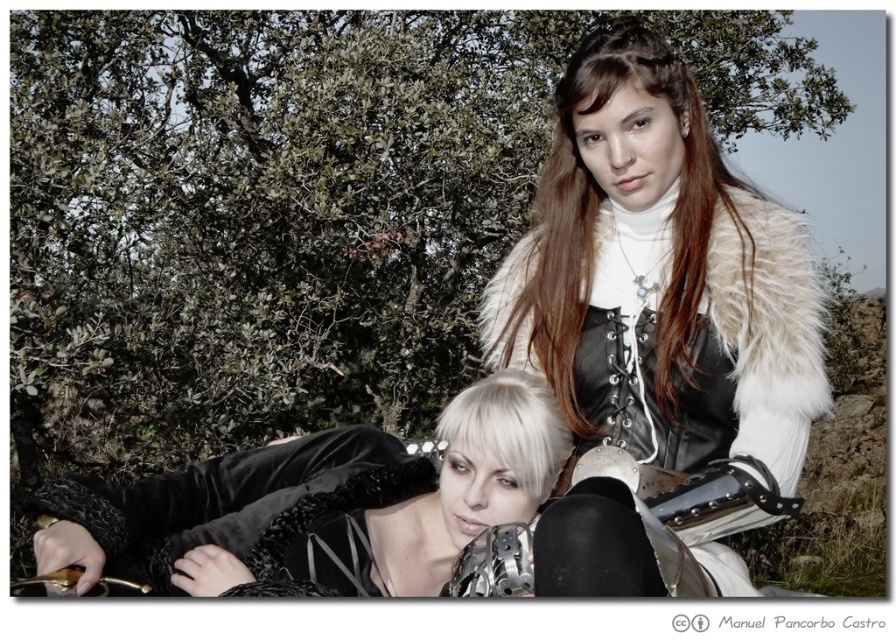
Who is taller, fur-lined leather vest at upper right or velvet black dress at lower left?

fur-lined leather vest at upper right

Based on the photo, which is above, fur-lined leather vest at upper right or velvet black dress at lower left?

fur-lined leather vest at upper right is above.

The height and width of the screenshot is (640, 896). Describe the element at coordinates (661, 280) in the screenshot. I see `fur-lined leather vest at upper right` at that location.

Locate an element on the screen. This screenshot has width=896, height=640. fur-lined leather vest at upper right is located at coordinates (661, 280).